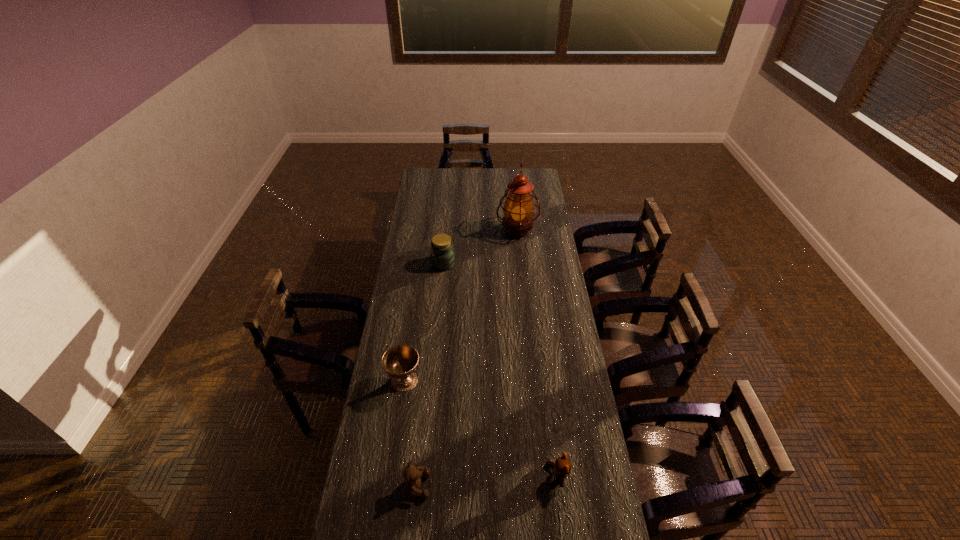
Find the location of `free space at the far left corner of the desktop`. free space at the far left corner of the desktop is located at coordinates (434, 173).

You are a GUI agent. You are given a task and a screenshot of the screen. Output one action in this format:
    pyautogui.click(x=<x>, y=<y>)
    Task: Click on the free spot between the left teddy bear and the second farthest object
    This screenshot has height=540, width=960.
    Given the screenshot: What is the action you would take?
    pyautogui.click(x=430, y=375)

You are a GUI agent. You are given a task and a screenshot of the screen. Output one action in this format:
    pyautogui.click(x=<x>, y=<y>)
    Task: Click on the vacant area between the left teddy bear and the tallest object
    
    Given the screenshot: What is the action you would take?
    pyautogui.click(x=467, y=358)

In order to click on vacant region between the right teddy bear and the left teddy bear in this screenshot , I will do `click(487, 481)`.

The image size is (960, 540). Identify the location of vacant area that lies between the second farthest object and the tallest object. (480, 247).

Where is `vacant space in between the jar and the right teddy bear`? The height and width of the screenshot is (540, 960). vacant space in between the jar and the right teddy bear is located at coordinates (500, 370).

Find the location of `free space between the farthest object and the jar`. free space between the farthest object and the jar is located at coordinates (480, 247).

Locate an element on the screen. the closest object relative to the left teddy bear is located at coordinates (400, 362).

You are a GUI agent. You are given a task and a screenshot of the screen. Output one action in this format:
    pyautogui.click(x=<x>, y=<y>)
    Task: Click on the object that ranks as the second closest to the second farthest object
    
    Given the screenshot: What is the action you would take?
    pyautogui.click(x=400, y=362)

This screenshot has height=540, width=960. I want to click on the closest teddy bear to the second farthest object, so click(x=412, y=475).